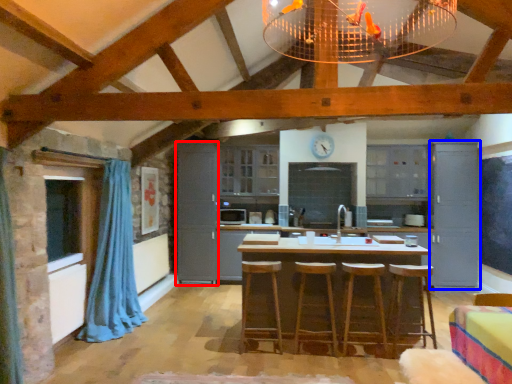
Question: Which object is further to the camera taking this photo, cabinetry (highlighted by a red box) or cabinetry (highlighted by a blue box)?

Choices:
 (A) cabinetry
 (B) cabinetry

Answer: (A)